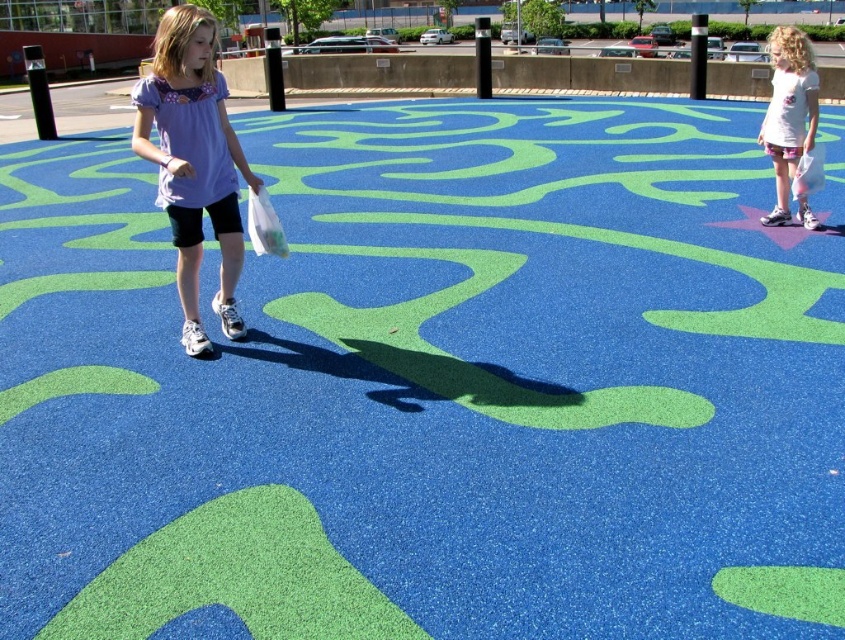
Question: Is matte purple shirt at center to the right of white cotton t-shirt at upper right from the viewer's perspective?

Choices:
 (A) no
 (B) yes

Answer: (A)

Question: Which point appears closest to the camera in this image?

Choices:
 (A) (215, 180)
 (B) (761, 144)

Answer: (A)

Question: Does matte purple shirt at center have a lesser width compared to white cotton t-shirt at upper right?

Choices:
 (A) yes
 (B) no

Answer: (A)

Question: Is matte purple shirt at center smaller than white cotton t-shirt at upper right?

Choices:
 (A) yes
 (B) no

Answer: (A)